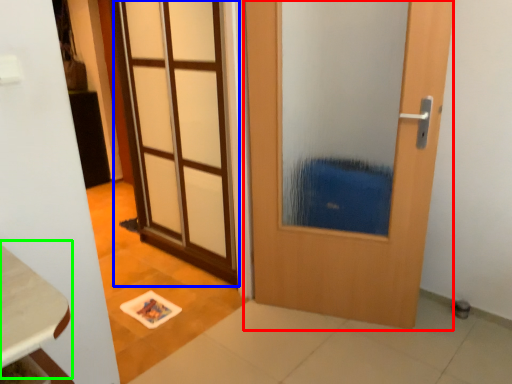
Question: Which object is positioned closest to door (highlighted by a red box)? Select from door (highlighted by a blue box) and table (highlighted by a green box).

Choices:
 (A) door
 (B) table

Answer: (A)